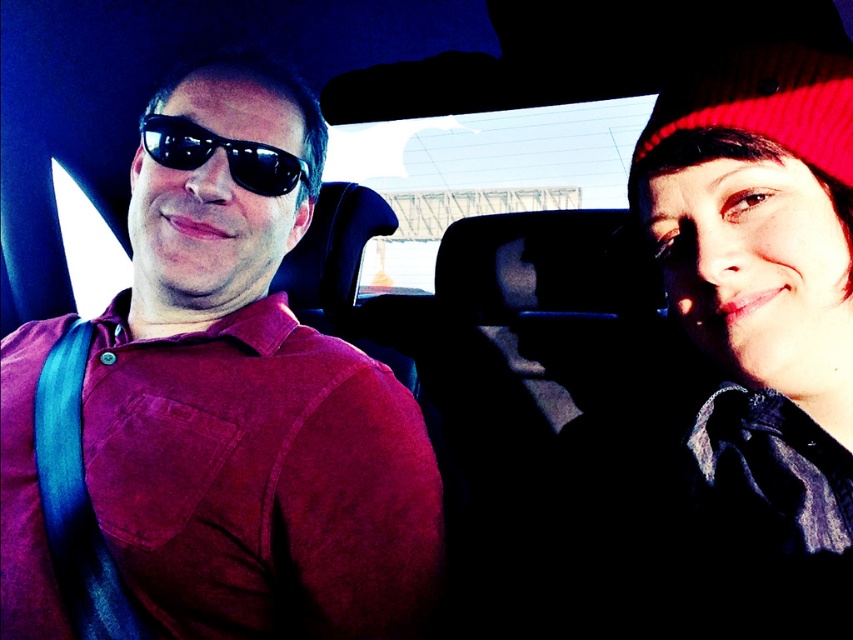
Who is positioned more to the left, matte black sunglasses at left or knitted red beanie at upper right?

Positioned to the left is matte black sunglasses at left.

Who is positioned more to the right, matte black sunglasses at left or knitted red beanie at upper right?

From the viewer's perspective, knitted red beanie at upper right appears more on the right side.

Identify the location of matte black sunglasses at left. The height and width of the screenshot is (640, 853). (248, 397).

Can you confirm if red knit hat at upper right is positioned above black reflective sunglasses at left?

No, red knit hat at upper right is not above black reflective sunglasses at left.

Between point (679, 92) and point (253, 192), which one is positioned behind?

Point (253, 192)

Identify the location of red knit hat at upper right. [762, 102].

Between knitted red beanie at upper right and red knit hat at upper right, which one has more height?

With more height is knitted red beanie at upper right.

In the scene shown: Can you confirm if knitted red beanie at upper right is positioned above red knit hat at upper right?

Actually, knitted red beanie at upper right is below red knit hat at upper right.

Which is in front, point (782, 88) or point (717, 61)?

Point (782, 88)

Find the location of `knitted red beanie at upper right`. knitted red beanie at upper right is located at coordinates (763, 323).